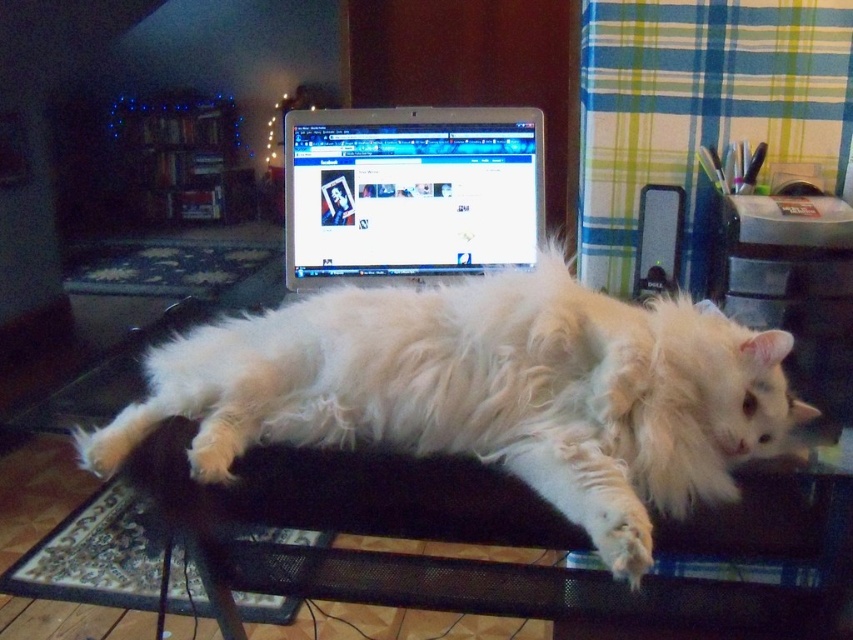
Question: Which of the following is the farthest from the observer?

Choices:
 (A) satin glossy monitor at center
 (B) white fluffy cat at center
 (C) black mesh table at center

Answer: (A)

Question: Is white fluffy cat at center thinner than satin glossy monitor at center?

Choices:
 (A) yes
 (B) no

Answer: (B)

Question: Is white fluffy cat at center above satin glossy monitor at center?

Choices:
 (A) yes
 (B) no

Answer: (B)

Question: Is white fluffy cat at center further to the viewer compared to black mesh table at center?

Choices:
 (A) yes
 (B) no

Answer: (B)

Question: Which point is closer to the camera?

Choices:
 (A) [323, 205]
 (B) [451, 292]
 (C) [804, 604]

Answer: (B)

Question: Based on their relative distances, which object is farther from the black mesh table at center?

Choices:
 (A) satin glossy monitor at center
 (B) white fluffy cat at center

Answer: (A)